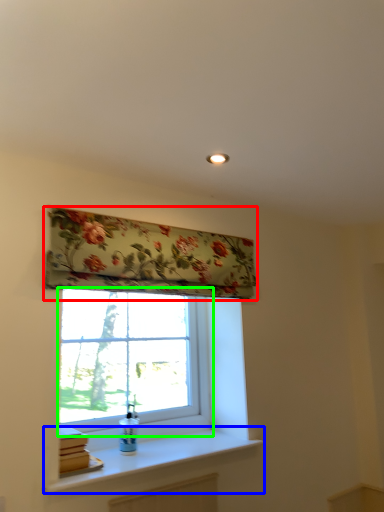
Question: Based on their relative distances, which object is nearer to window blind (highlighted by a red box)? Choose from window sill (highlighted by a blue box) and window (highlighted by a green box).

Choices:
 (A) window sill
 (B) window

Answer: (B)